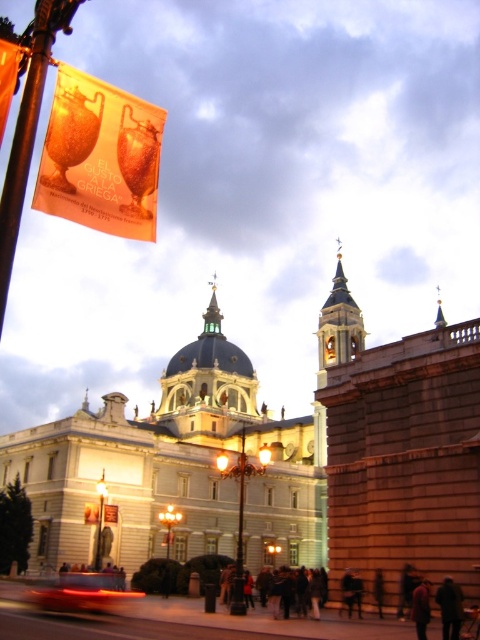
You are a pedestrian standing on the sidewalk in front of the cathedral. You see both the dark brown leather coat at lower right and the dark brown leather jacket at lower right. Which one is closer to you?

The dark brown leather coat at lower right is closer to you because it is in front of the dark brown leather jacket at lower right.

You are a photographer planning to capture the golden dome at center and the gold textured spire at upper center in a single shot. Based on their sizes, which object would appear more prominent in the photo?

The golden dome at center would appear more prominent in the photo because it has a larger size compared to the gold textured spire at upper center.